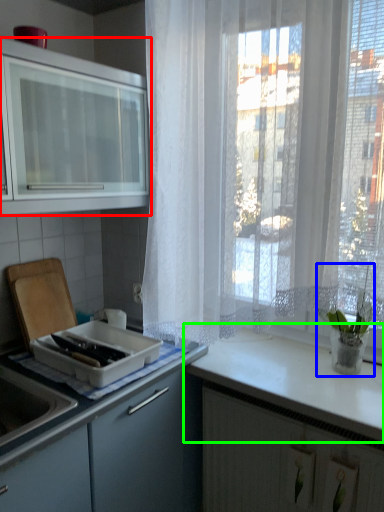
Question: Based on their relative distances, which object is farther from cabinetry (highlighted by a red box)? Choose from houseplant (highlighted by a blue box) and countertop (highlighted by a green box).

Choices:
 (A) houseplant
 (B) countertop

Answer: (A)